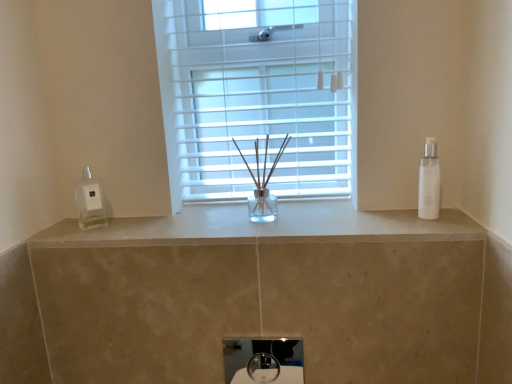
You are a GUI agent. You are given a task and a screenshot of the screen. Output one action in this format:
    pyautogui.click(x=<x>, y=<y>)
    Task: Click on the free spot behind white glossy soap dispenser at left
    The height and width of the screenshot is (384, 512).
    Given the screenshot: What is the action you would take?
    pyautogui.click(x=102, y=218)